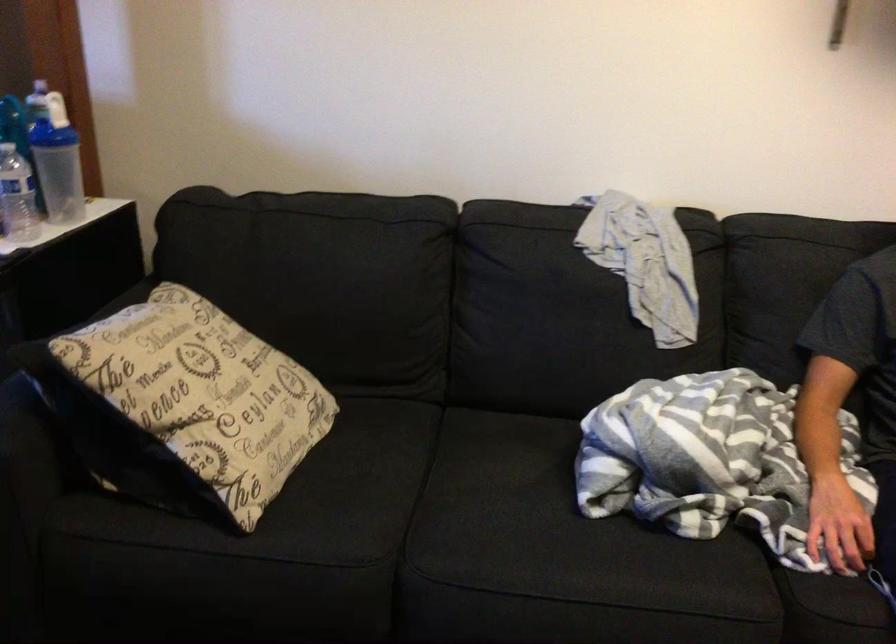
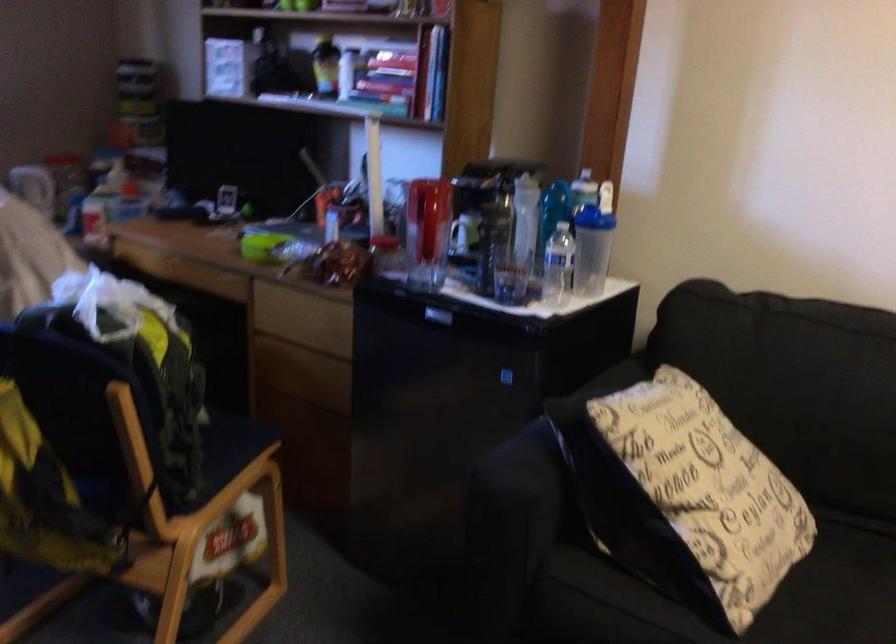
Question: The camera is either moving clockwise (left) or counter-clockwise (right) around the object. The first image is from the beginning of the video and the second image is from the end. Is the camera moving left or right when shooting the video?

Choices:
 (A) Left
 (B) Right

Answer: (B)